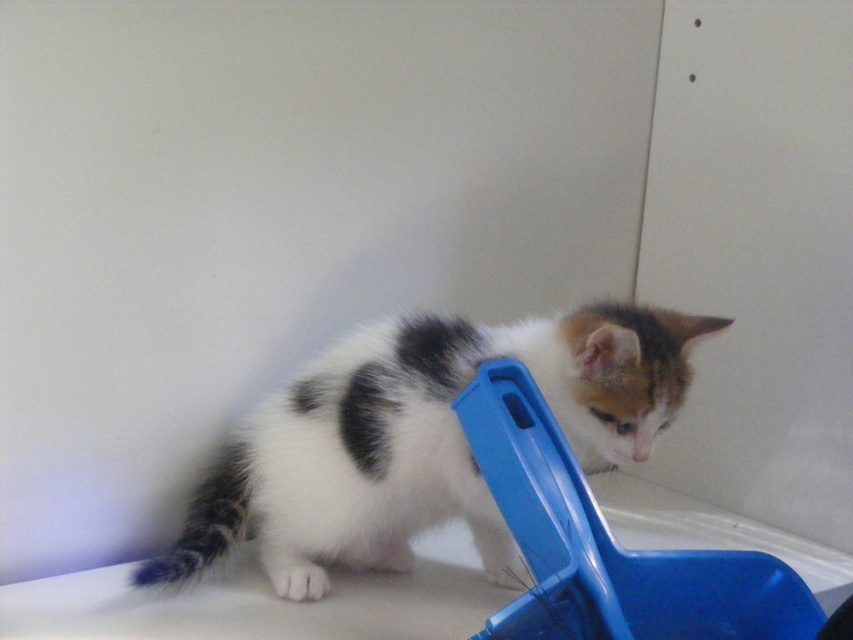
Is white fur cat at center to the right of blue plastic scoop at lower center from the viewer's perspective?

No, white fur cat at center is not to the right of blue plastic scoop at lower center.

Can you confirm if white fur cat at center is taller than blue plastic scoop at lower center?

Correct, white fur cat at center is much taller as blue plastic scoop at lower center.

What do you see at coordinates (422, 440) in the screenshot? The height and width of the screenshot is (640, 853). I see `white fur cat at center` at bounding box center [422, 440].

Locate an element on the screen. The height and width of the screenshot is (640, 853). white fur cat at center is located at coordinates (422, 440).